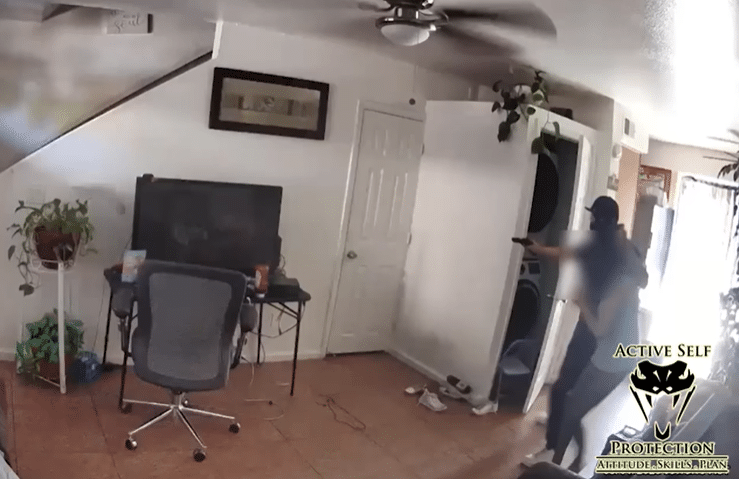
Find the location of a particular element. picture is located at coordinates (259, 96).